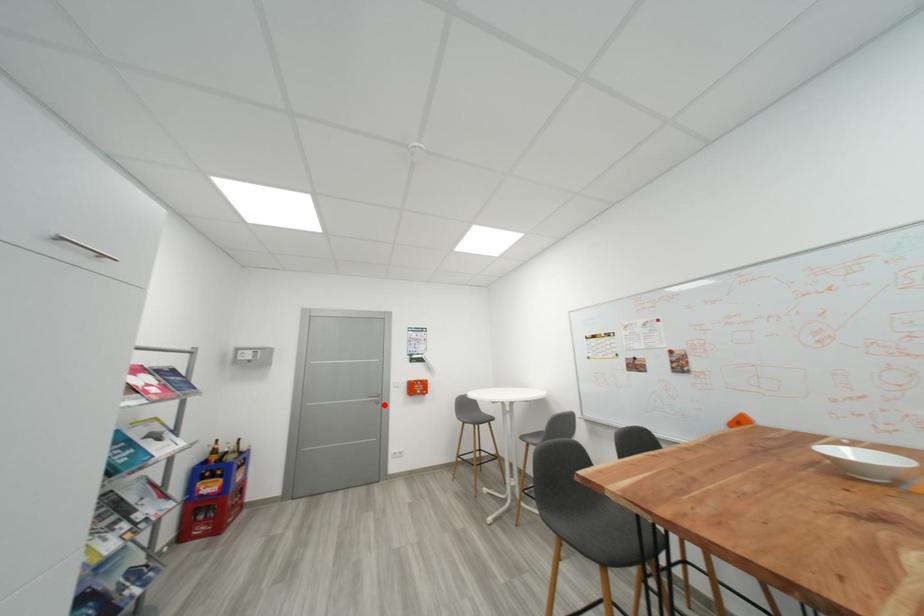
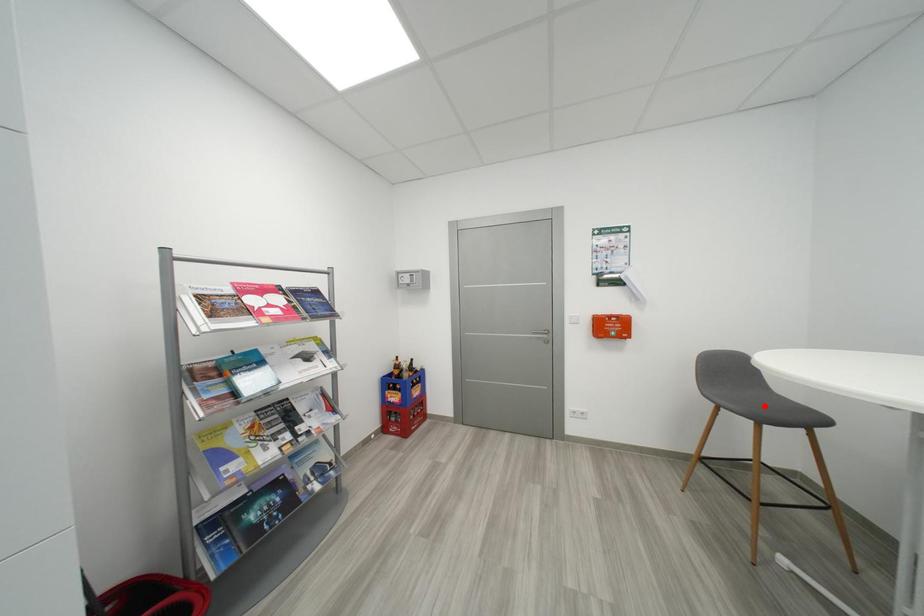
From the picture: I am providing you with two images of the same scene from different viewpoints. A red point is marked on the first image and another point is marked on the second image. Is the marked point in image1 the same physical position as the marked point in image2?

No